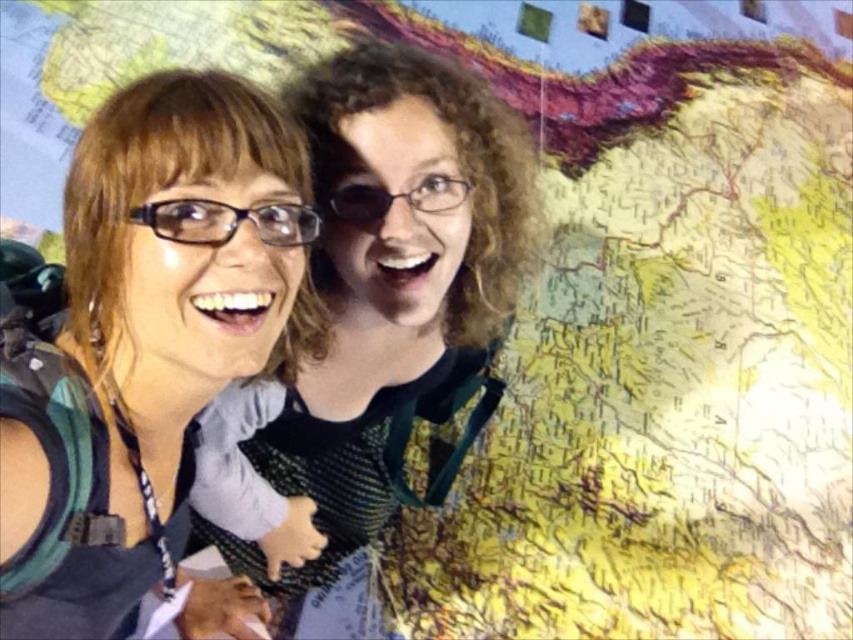
You are an optometrist examining two pairs of glasses in the image. The first pair is the matte black glasses at left, and the second pair is the matte black glasses at center. Based on their physical dimensions, which pair would you recommend for someone who prefers a more slender frame?

The matte black glasses at left is thinner than matte black glasses at center, so the matte black glasses at left would be the better recommendation for someone preferring a more slender frame.

You are a photographer who wants to take a picture of the two people standing against the map. You notice the matte black glasses at left and the camera. How far apart are they?

The matte black glasses at left and the camera are 24.34 inches apart from each other.

You are looking at the image of two people near a map. The person on the left is wearing glasses. Where exactly are the matte black glasses at left located in the image?

The matte black glasses at left are located at point (x=144, y=342) in the image.